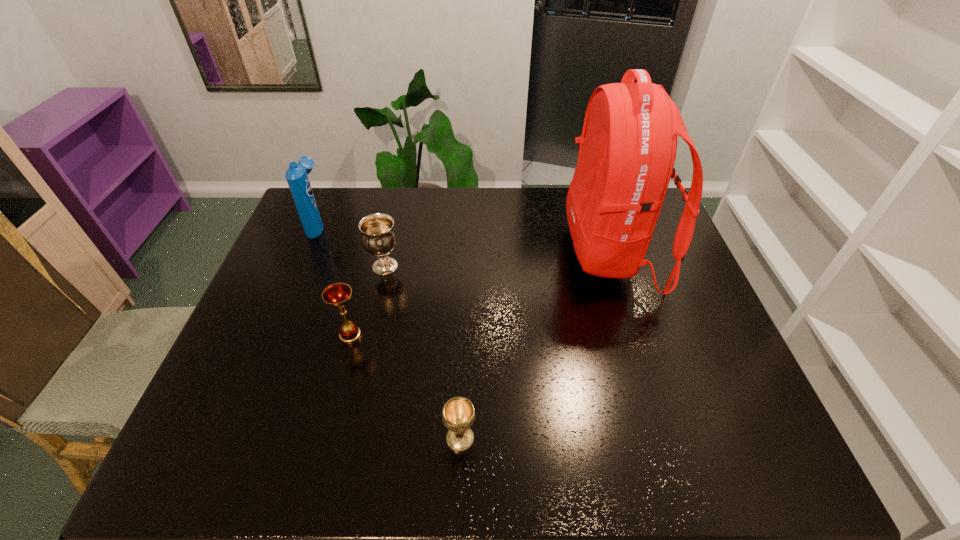
This screenshot has height=540, width=960. What are the coordinates of `free spot that satisfies the following two spatial constraints: 1. on the front side of the shortest chalice; 2. on the right side of the fourth farthest object` in the screenshot? It's located at (324, 439).